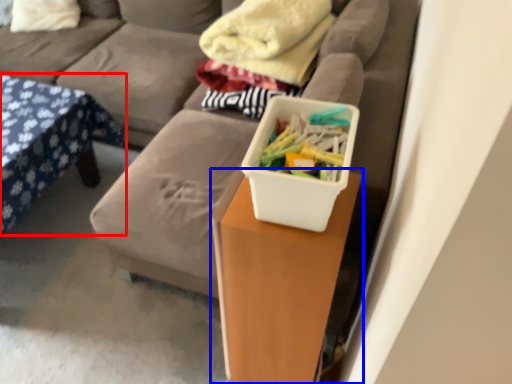
Question: Among these objects, which one is farthest to the camera, furniture (highlighted by a red box) or table (highlighted by a blue box)?

Choices:
 (A) furniture
 (B) table

Answer: (A)